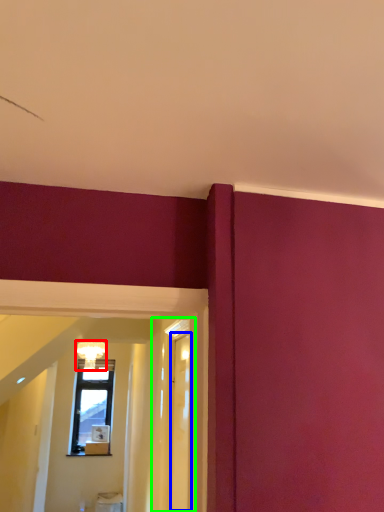
Question: Which object is positioned closest to light fixture (highlighted by a red box)? Select from glass door (highlighted by a blue box) and glass door (highlighted by a green box).

Choices:
 (A) glass door
 (B) glass door

Answer: (B)